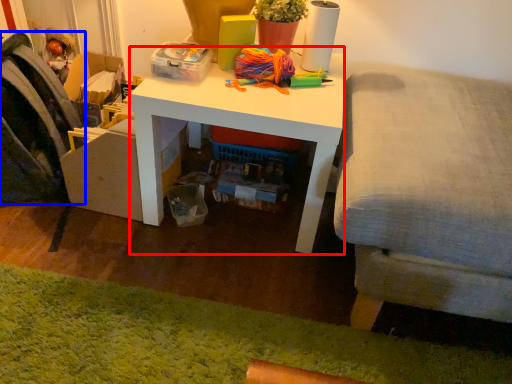
Question: Which object is closer to the camera taking this photo, desk (highlighted by a red box) or swivel chair (highlighted by a blue box)?

Choices:
 (A) desk
 (B) swivel chair

Answer: (A)